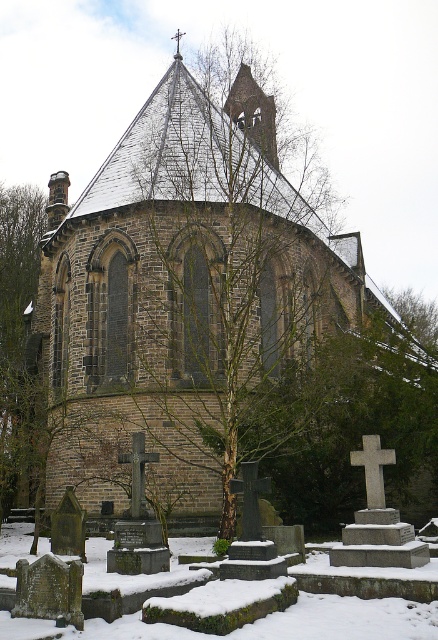
Measure the distance from brown stone church at center to white frosty snow at lower center.

brown stone church at center and white frosty snow at lower center are 26.52 meters apart from each other.

Who is more forward, (73, 390) or (116, 620)?

Point (116, 620)

Image resolution: width=438 pixels, height=640 pixels. I want to click on brown stone church at center, so click(183, 289).